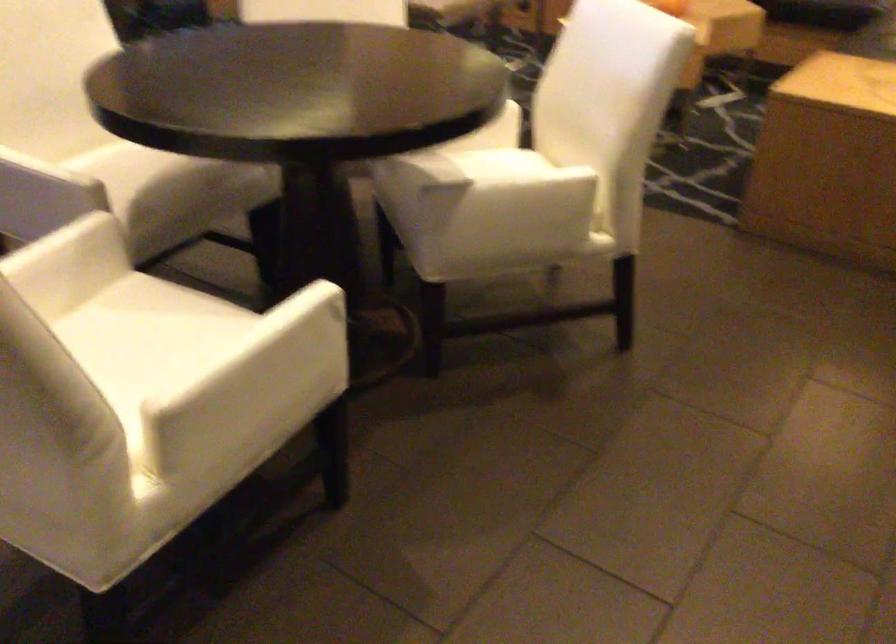
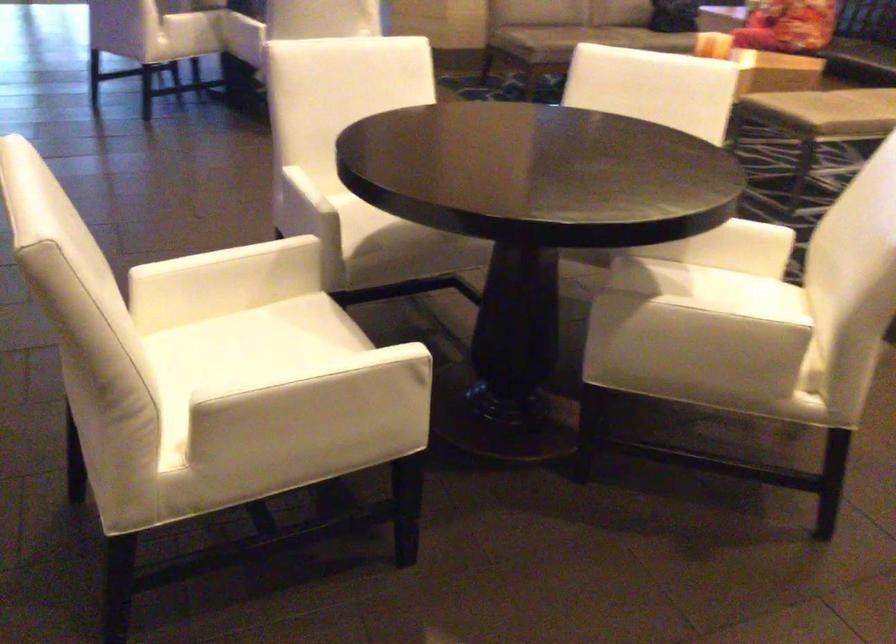
Question: The first image is from the beginning of the video and the second image is from the end. How did the camera likely rotate when shooting the video?

Choices:
 (A) Left
 (B) Right
 (C) Up
 (D) Down

Answer: (A)